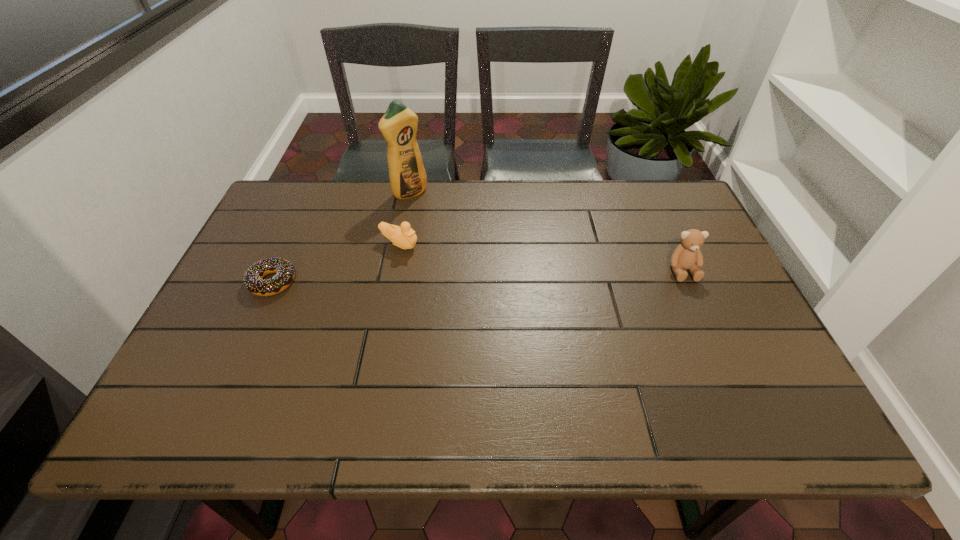
Where is `vacant space located 0.100m on the face of the third tallest object`? vacant space located 0.100m on the face of the third tallest object is located at coordinates (446, 261).

At what (x,y) coordinates should I click in order to perform the action: click on vacant region located 0.080m on the face of the third tallest object. Please return your answer as a coordinate pair (x, y). The height and width of the screenshot is (540, 960). Looking at the image, I should click on (440, 259).

The height and width of the screenshot is (540, 960). What are the coordinates of `free space located 0.250m on the face of the third tallest object` in the screenshot? It's located at (495, 281).

I want to click on vacant space located on the label of the farthest object, so click(x=431, y=211).

Locate an element on the screen. vacant space situated on the label of the farthest object is located at coordinates (441, 219).

What are the coordinates of `vacant point located 0.250m on the label of the farthest object` in the screenshot? It's located at (467, 242).

Find the location of a particular element. object that is at the far edge is located at coordinates (399, 124).

At what (x,y) coordinates should I click in order to perform the action: click on object that is at the left edge. Please return your answer as a coordinate pair (x, y). Looking at the image, I should click on (253, 279).

The width and height of the screenshot is (960, 540). Identify the location of object positioned at the right edge. (687, 255).

At what (x,y) coordinates should I click in order to perform the action: click on vacant space at the far edge of the desktop. Please return your answer as a coordinate pair (x, y). The height and width of the screenshot is (540, 960). Looking at the image, I should click on (531, 188).